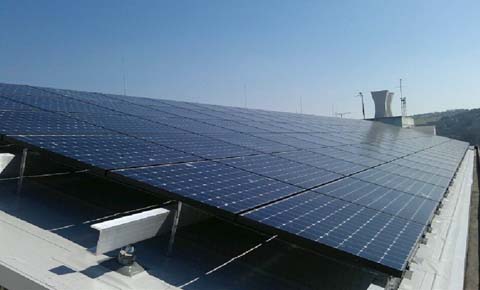
Identify the location of steel or wood beams below panels. Image resolution: width=480 pixels, height=290 pixels. (132, 227), (5, 158).